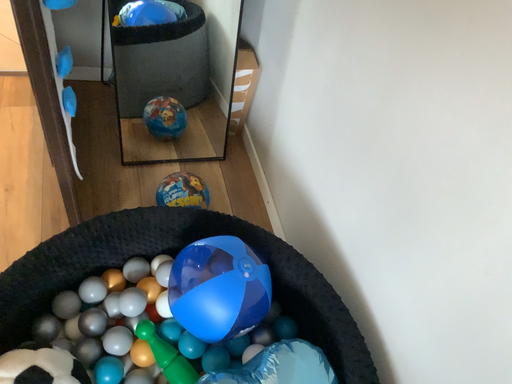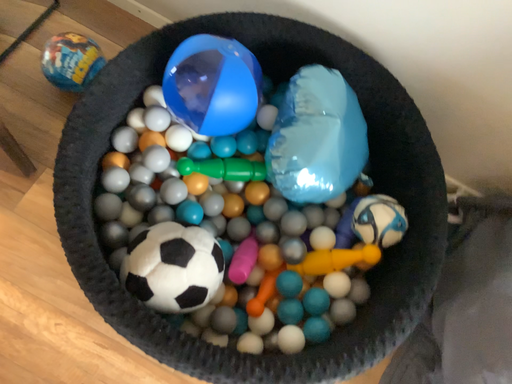
Question: Which way did the camera rotate in the video?

Choices:
 (A) rotated left
 (B) rotated right

Answer: (B)